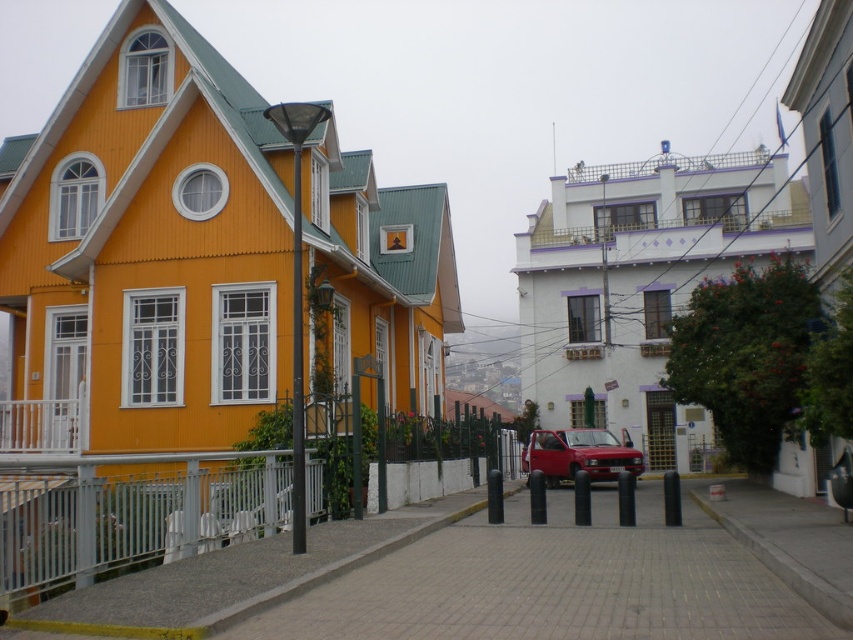
Question: Which object appears closest to the camera in this image?

Choices:
 (A) matte red car at center
 (B) white painted metal railing at lower left

Answer: (B)

Question: From the image, what is the correct spatial relationship of white painted metal railing at lower left in relation to matte red car at center?

Choices:
 (A) right
 (B) left

Answer: (B)

Question: Among these objects, which one is nearest to the camera?

Choices:
 (A) white painted metal railing at lower left
 (B) matte red car at center

Answer: (A)

Question: In this image, where is white painted metal railing at lower left located relative to matte red car at center?

Choices:
 (A) left
 (B) right

Answer: (A)

Question: Which point appears farthest from the camera in this image?

Choices:
 (A) 219,486
 (B) 601,472

Answer: (B)

Question: Does white painted metal railing at lower left lie in front of matte red car at center?

Choices:
 (A) yes
 (B) no

Answer: (A)